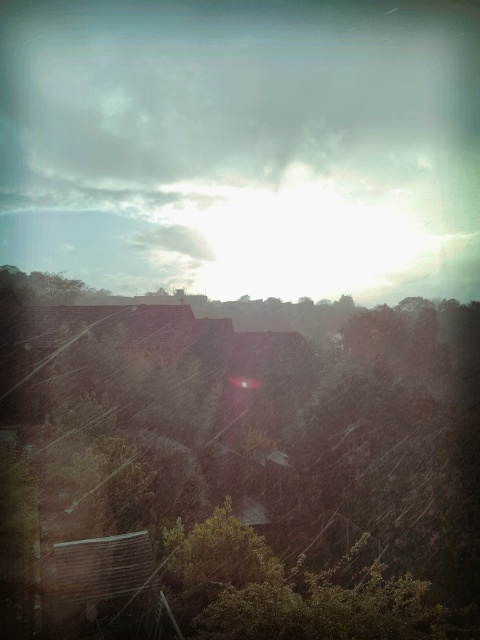
Question: Which point is closer to the camera?

Choices:
 (A) (215, 65)
 (B) (264, 403)

Answer: (B)

Question: Which point appears farthest from the camera in this image?

Choices:
 (A) (132, 506)
 (B) (385, 77)

Answer: (B)

Question: Can you confirm if cloudy sky at upper center is bigger than green leafy tree at center?

Choices:
 (A) yes
 (B) no

Answer: (A)

Question: Is cloudy sky at upper center further to camera compared to green leafy tree at center?

Choices:
 (A) no
 (B) yes

Answer: (B)

Question: Which object appears closest to the camera in this image?

Choices:
 (A) green leafy tree at center
 (B) cloudy sky at upper center

Answer: (A)

Question: Does cloudy sky at upper center have a larger size compared to green leafy tree at center?

Choices:
 (A) no
 (B) yes

Answer: (B)